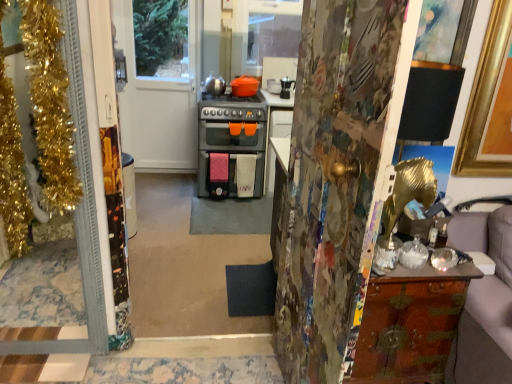
Question: Considering the positions of white glossy door at upper center, the 1th door from the back, and wooden cabinet at right in the image, is white glossy door at upper center, the 1th door from the back, wider or thinner than wooden cabinet at right?

Choices:
 (A) wide
 (B) thin

Answer: (B)

Question: In terms of height, does white glossy door at upper center, which is the 2th door in right-to-left order, look taller or shorter compared to wooden cabinet at right?

Choices:
 (A) tall
 (B) short

Answer: (A)

Question: Estimate the real-world distances between objects in this image. Which object is closer to the white glossy door at upper center, the 1th door from the back?

Choices:
 (A) gold tinsel at left, positioned as the second door in back-to-front order
 (B) painted wood door at center, marked as the 1th door in a right-to-left arrangement
 (C) wooden cabinet at right

Answer: (A)

Question: Which of these objects is positioned closest to the wooden cabinet at right?

Choices:
 (A) gold tinsel at left, positioned as the second door in back-to-front order
 (B) white glossy door at upper center, which is the 2th door in right-to-left order
 (C) painted wood door at center, marked as the 3th door in a left-to-right arrangement

Answer: (C)